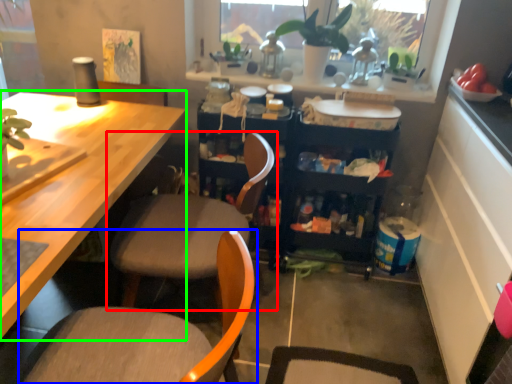
Question: Based on their relative distances, which object is farther from chair (highlighted by a red box)? Choose from chair (highlighted by a blue box) and desk (highlighted by a green box).

Choices:
 (A) chair
 (B) desk

Answer: (A)